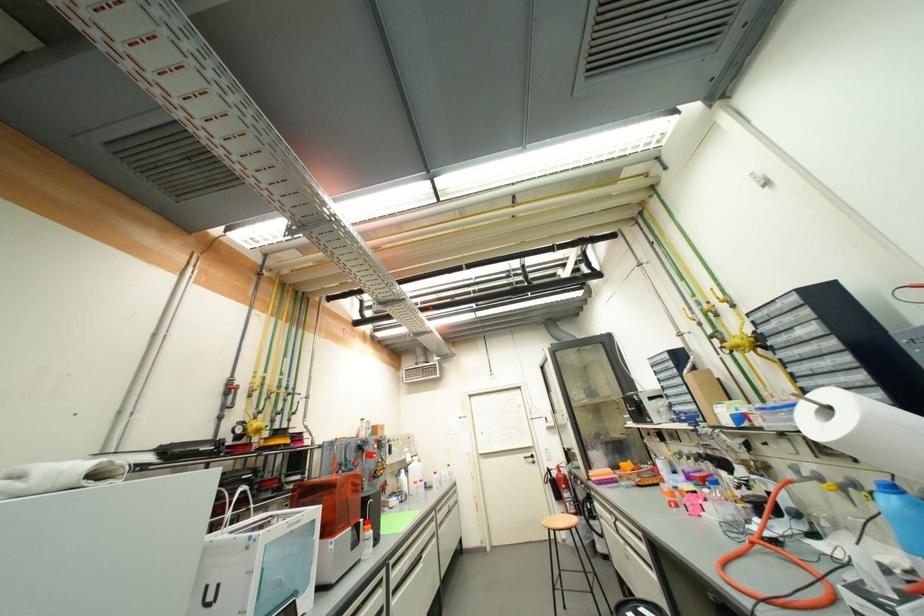
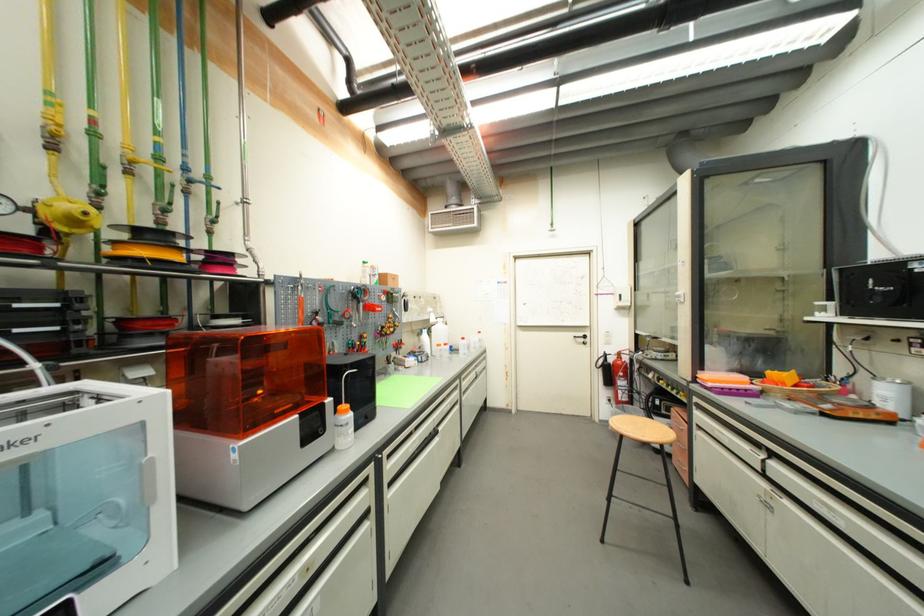
The point at the highlighted location is marked in the first image. Where is the corresponding point in the second image?

(334, 402)